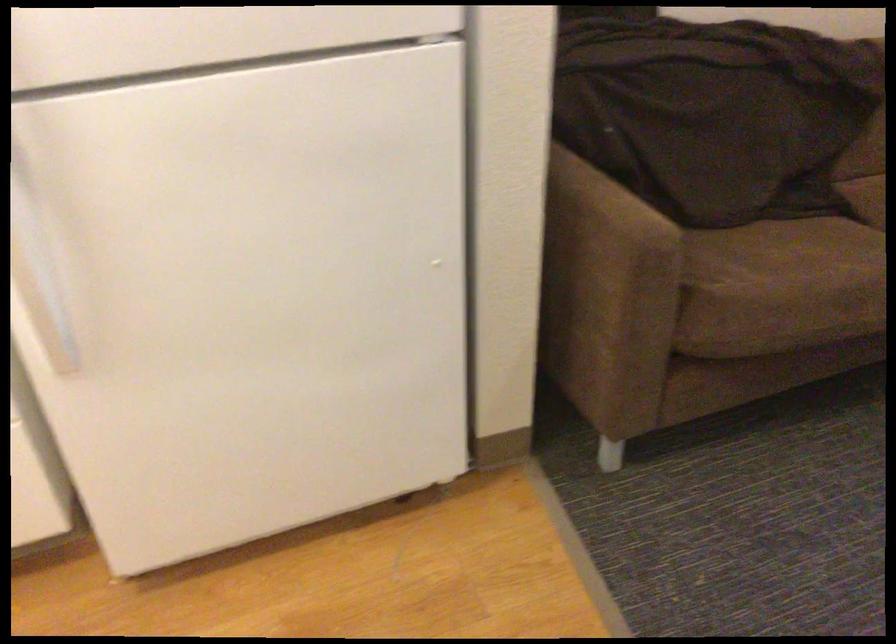
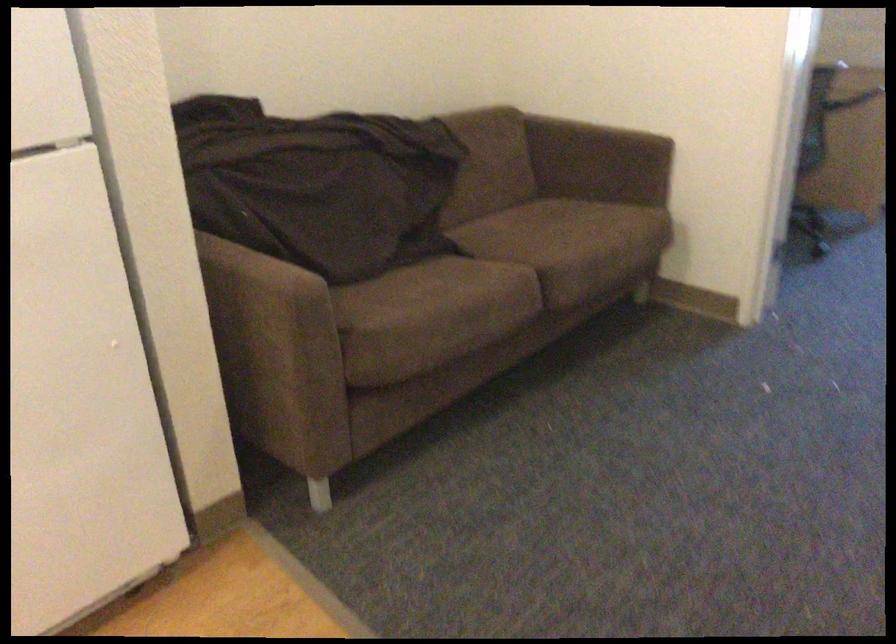
Where in the second image is the point corresponding to point (800, 245) from the first image?

(429, 279)